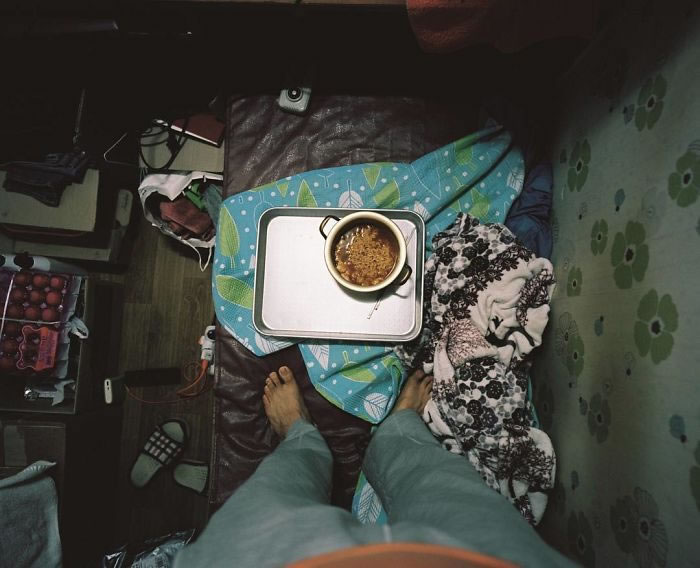
At what (x,y) coordinates should I click in order to perform the action: click on metal tray. Please return your answer as a coordinate pair (x, y). The height and width of the screenshot is (568, 700). Looking at the image, I should click on (286, 290).